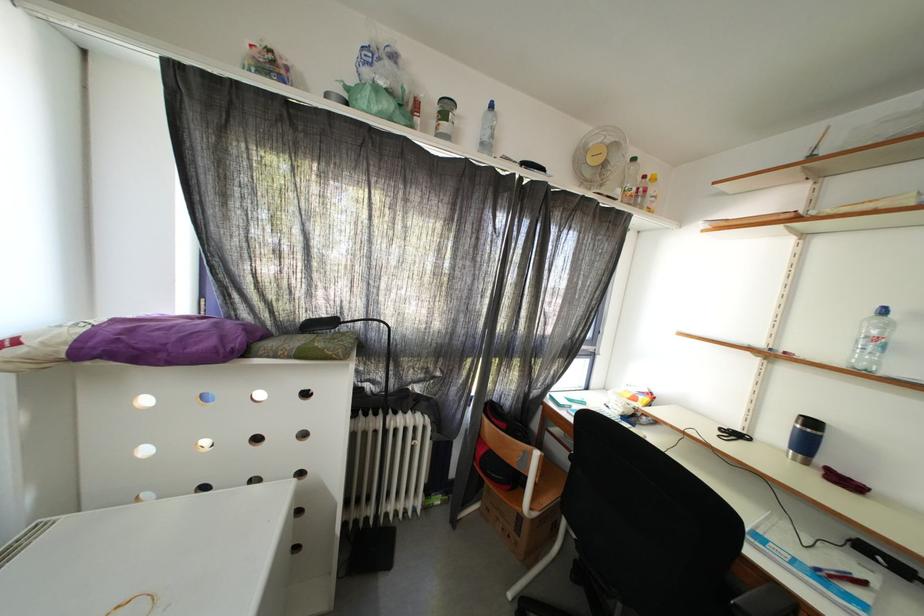
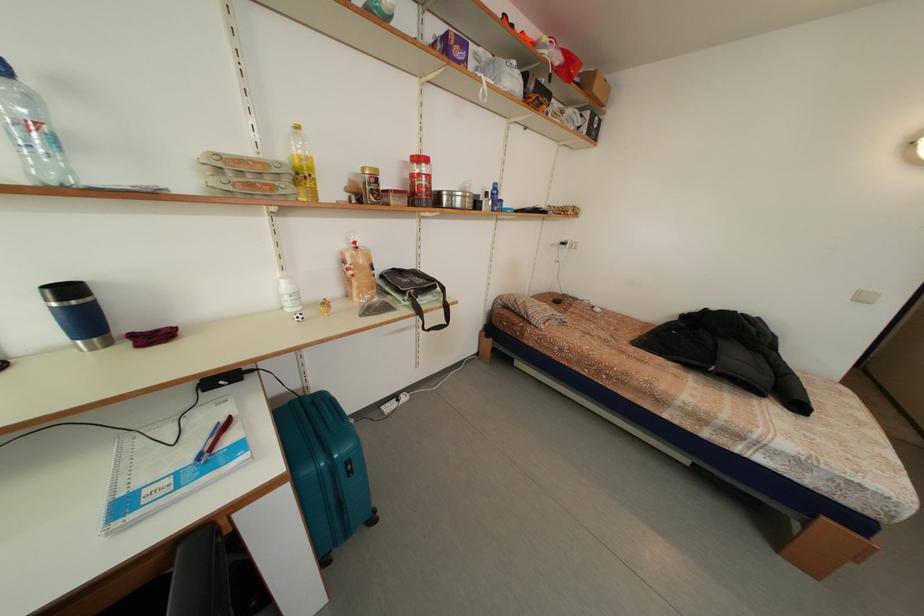
In the second image, find the point that corresponds to [895,331] in the first image.

(40, 106)